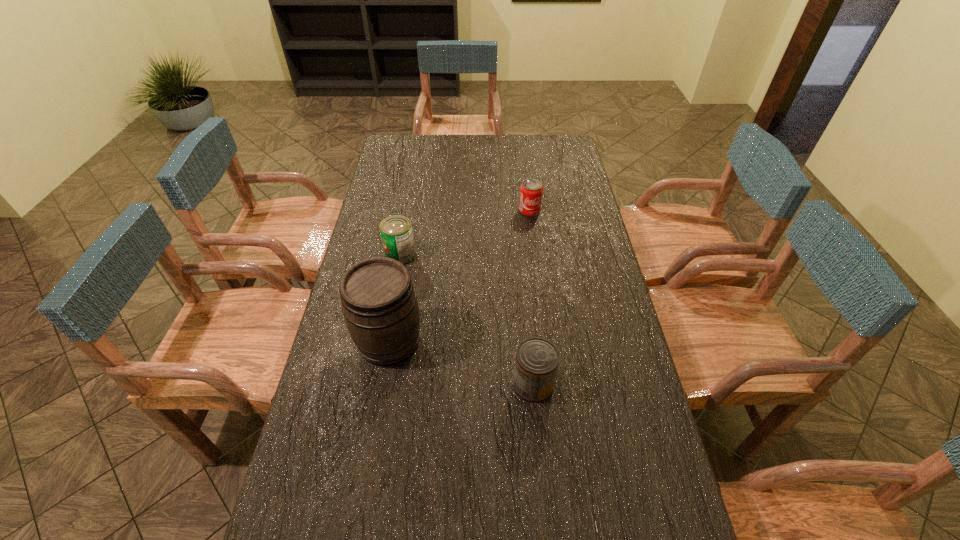
I want to click on can located in the left edge section of the desktop, so [x=396, y=231].

In the image, there is a desktop. Where is `blank space at the far edge`? The height and width of the screenshot is (540, 960). blank space at the far edge is located at coordinates (447, 147).

Locate an element on the screen. This screenshot has height=540, width=960. vacant space at the left edge of the desktop is located at coordinates (375, 247).

Find the location of a particular element. The image size is (960, 540). vacant area at the right edge of the desktop is located at coordinates (594, 308).

Where is `vacant space at the far left corner of the desktop`? vacant space at the far left corner of the desktop is located at coordinates (408, 151).

This screenshot has width=960, height=540. I want to click on vacant space in between the nearest can and the wine bucket, so click(x=461, y=363).

Image resolution: width=960 pixels, height=540 pixels. I want to click on empty space that is in between the nearest can and the farthest can, so click(x=531, y=298).

The image size is (960, 540). In order to click on free area in between the nearest can and the farthest object in this screenshot , I will do click(x=531, y=298).

This screenshot has height=540, width=960. In order to click on vacant area that lies between the farthest object and the tallest object in this screenshot , I will do `click(460, 276)`.

Where is `the third closest object to the wine bucket`? the third closest object to the wine bucket is located at coordinates (531, 190).